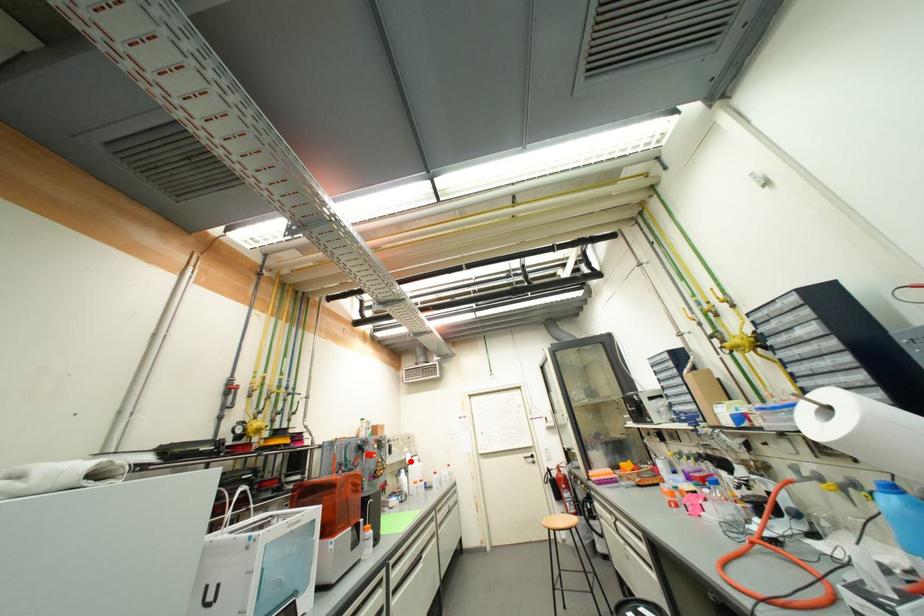
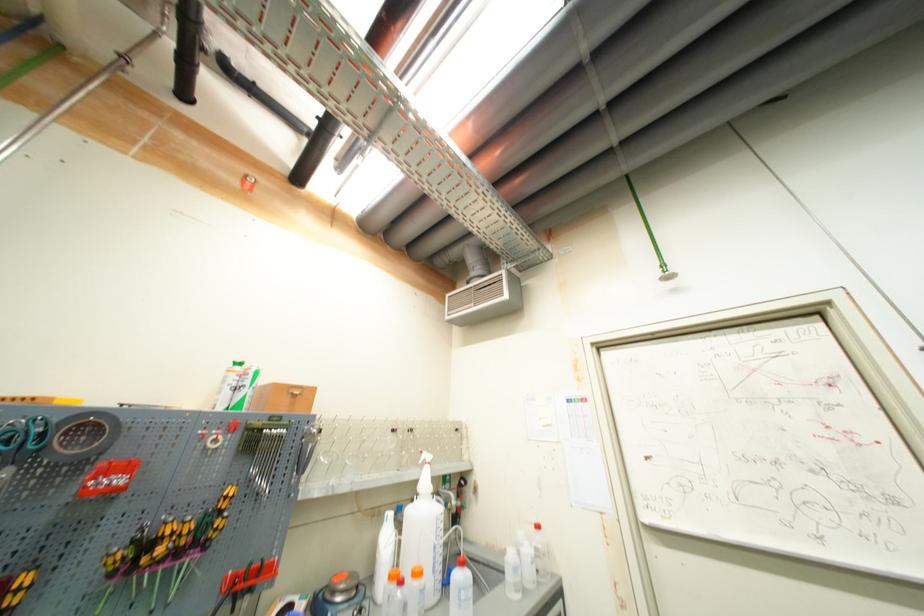
Locate, in the second image, the point that corresponds to the highlighted location in the first image.

(421, 484)